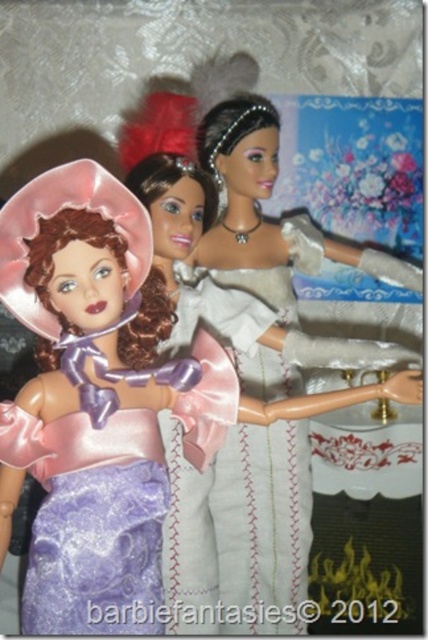
You are an interior designer arranging a display with the lavender satin dress at left and other items. Based on its position, where should you place a decorative vase to ensure it doesn not block the view of the dress?

The lavender satin dress at left is located at point (89,397), so place the decorative vase away from that coordinate to avoid blocking the view.

You are a fashion designer observing the dolls in the image. You need to decide which dress is shorter between the lavender satin dress at left and the matte silver dress at center. Based on the scene, which one is shorter?

The lavender satin dress at left is shorter than the matte silver dress at center.